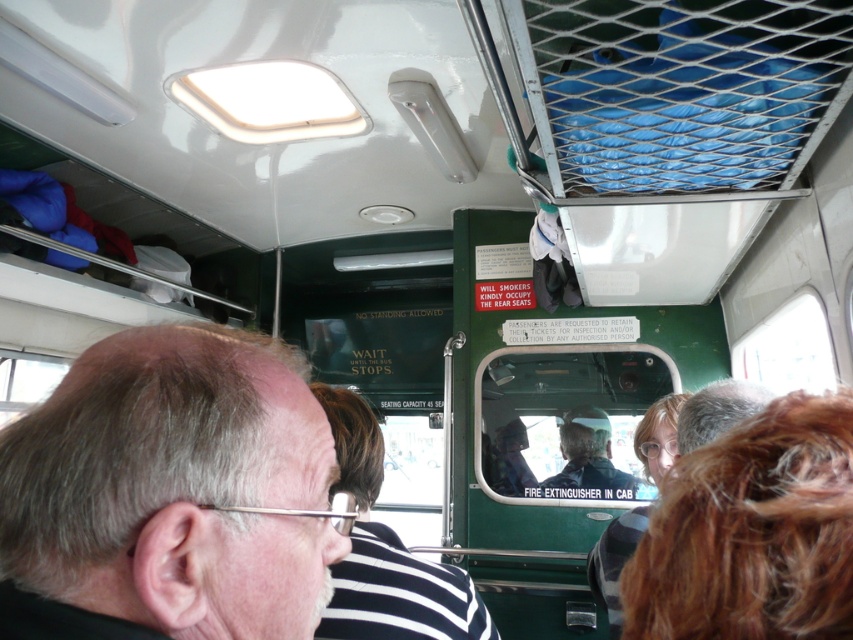
You are a passenger sitting in the front of the bus. You notice two people in the seating area. One has brown curly hair at lower right and another is wearing a striped fabric shirt at center. From your perspective, which person is sitting to the right of the other?

The brown curly hair at lower right is to the right of striped fabric shirt at center, so the person with brown curly hair at lower right is sitting to the right of the person wearing the striped fabric shirt at center.

You are a passenger on this vintage bus and notice two passengers with distinct hairstyles. One has gray hair at upper left and another has brown curly hair at lower right. Which passenger has a larger hairstyle?

The gray hair at upper left is bigger than brown curly hair at lower right, so the passenger with gray hair at upper left has a larger hairstyle.